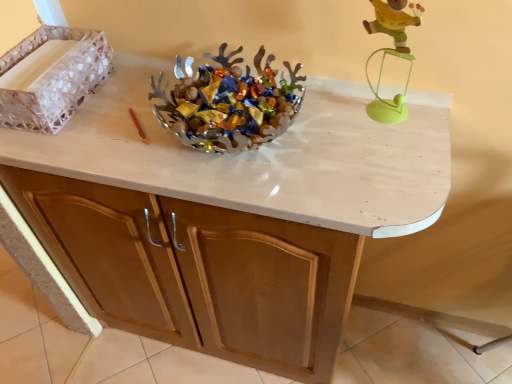
This screenshot has width=512, height=384. I want to click on empty space that is in between wooden figure at upper right and metallic silver bowl at center, so click(x=331, y=129).